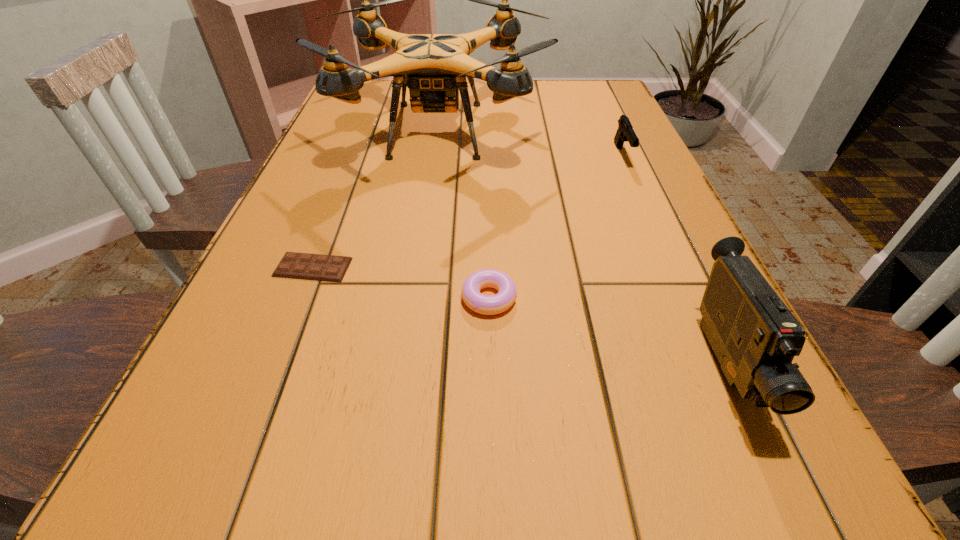
I want to click on the tallest object, so click(x=434, y=67).

Find the location of a particular element. Image resolution: width=960 pixels, height=540 pixels. camcorder is located at coordinates (753, 334).

This screenshot has width=960, height=540. In order to click on the third tallest object in this screenshot , I will do `click(625, 132)`.

Where is `the fourth tallest object`? The width and height of the screenshot is (960, 540). the fourth tallest object is located at coordinates (507, 292).

This screenshot has width=960, height=540. Identify the location of the shortest object. (330, 268).

The image size is (960, 540). Identify the location of free space located 0.070m on the camera mount of the tallest object. (571, 130).

In order to click on vacant space located 0.250m on the front-facing side of the third tallest object in this screenshot , I will do `click(661, 242)`.

What are the coordinates of `vacant space positioned 0.220m on the back of the second shortest object` in the screenshot? It's located at (487, 202).

I want to click on vacant space situated 0.070m on the right of the chocolate bar, so click(391, 267).

The width and height of the screenshot is (960, 540). I want to click on object situated at the far edge, so pyautogui.click(x=434, y=67).